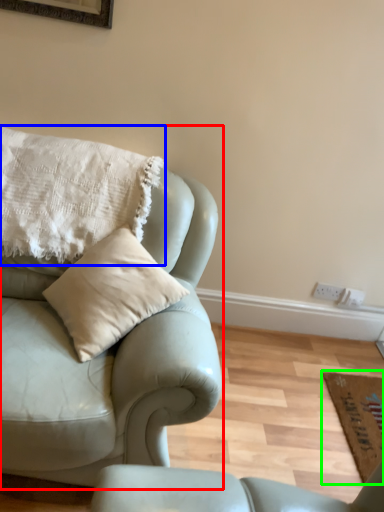
Question: Which object is the farthest from studio couch (highlighted by a red box)? Choose among these: pillow (highlighted by a blue box) or mat (highlighted by a green box).

Choices:
 (A) pillow
 (B) mat

Answer: (B)